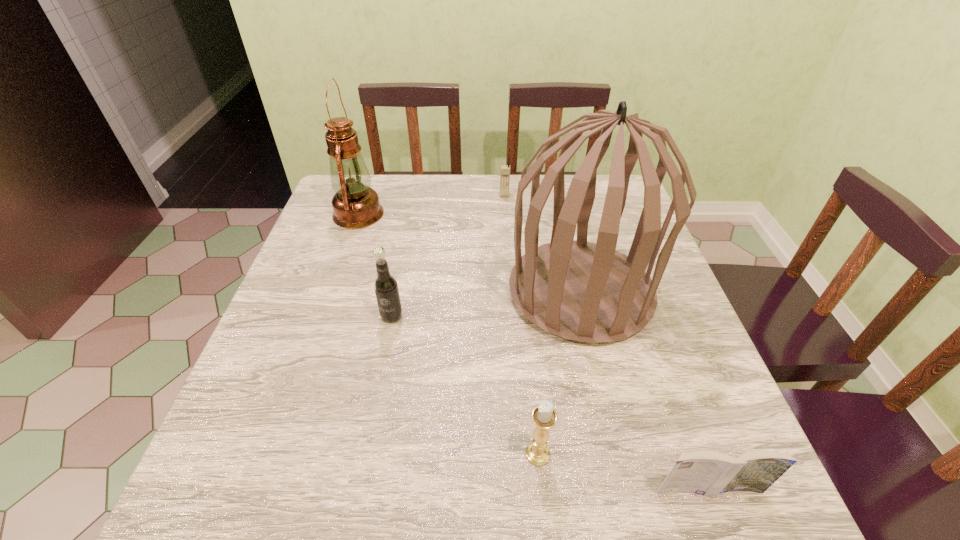
Where is `free space that is in between the root beer and the cellular telephone`? free space that is in between the root beer and the cellular telephone is located at coordinates (448, 255).

The height and width of the screenshot is (540, 960). What are the coordinates of `vacant space in between the fourth shortest object and the cellular telephone` in the screenshot? It's located at pos(448,255).

I want to click on free space between the birdcage and the fifth farthest object, so click(x=559, y=373).

Identify the location of vacant region between the book and the oil lamp. The image size is (960, 540). (533, 352).

You are a GUI agent. You are given a task and a screenshot of the screen. Output one action in this format:
    pyautogui.click(x=<x>, y=<y>)
    Task: Click on the free space between the root beer and the birdcage
    
    Given the screenshot: What is the action you would take?
    pyautogui.click(x=486, y=304)

Image resolution: width=960 pixels, height=540 pixels. I want to click on vacant space in between the cellular telephone and the nearest object, so click(x=607, y=342).

Where is `free space between the second nearest object and the leftmost object`? The image size is (960, 540). free space between the second nearest object and the leftmost object is located at coordinates (448, 334).

Find the location of `free space that is in between the fourth shortest object and the tallest object`. free space that is in between the fourth shortest object and the tallest object is located at coordinates (486, 304).

Where is `vacant space that is in between the oil lamp and the tallest object`? The width and height of the screenshot is (960, 540). vacant space that is in between the oil lamp and the tallest object is located at coordinates (469, 253).

Choose which object is the third nearest neighbor to the birdcage. Please provide its 2D coordinates. Your answer should be formatted as a tuple, i.e. [(x, y)], where the tuple contains the x and y coordinates of a point satisfying the conditions above.

[(385, 285)]